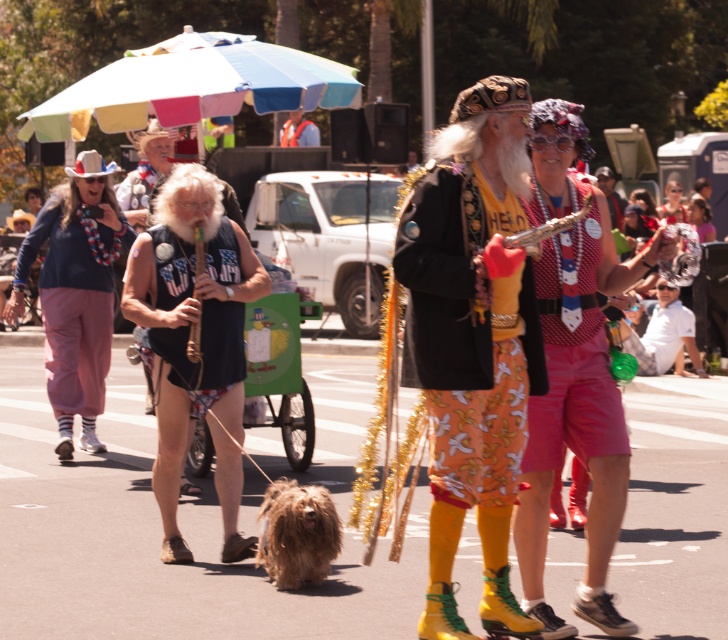
You are standing at the origin point of the image. Which object is located at the coordinates point (75, 291)?

The matte pink pants at left is located at the coordinates point (75, 291).

You are a photographer trying to capture a clear shot of both the black fabric vest at center and the floral cotton shorts at center. Since the vest is larger, where should you position your camera to ensure both objects are in frame?

Since the black fabric vest at center is larger than the floral cotton shorts at center, positioning the camera slightly closer to the floral cotton shorts at center will help balance their sizes in the photo, ensuring both are clearly visible in the frame.